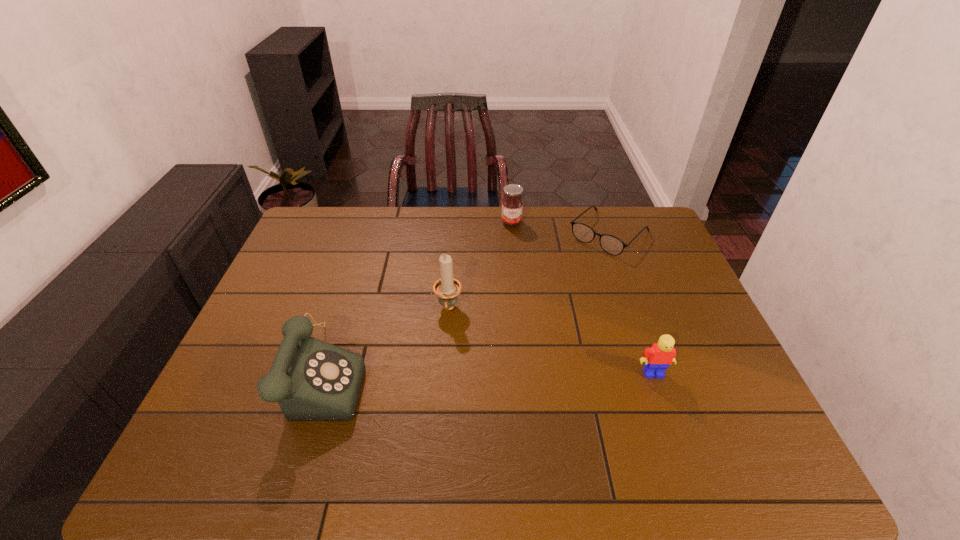
Locate an element on the screen. the leftmost object is located at coordinates (312, 380).

Identify the location of telephone. The width and height of the screenshot is (960, 540). (312, 380).

Find the location of a particular element. Lego is located at coordinates point(657,358).

Where is `the third object from right to left`? Image resolution: width=960 pixels, height=540 pixels. the third object from right to left is located at coordinates (512, 204).

What are the coordinates of `spectacles` in the screenshot? It's located at (612, 245).

Where is `the fourth object from right to left`? the fourth object from right to left is located at coordinates (447, 289).

The width and height of the screenshot is (960, 540). What are the coordinates of `the tallest object` in the screenshot? It's located at (447, 289).

I want to click on free space located on the dial of the leftmost object, so click(438, 373).

The width and height of the screenshot is (960, 540). In order to click on vacant space situated on the front-facing side of the Lego in this screenshot , I will do `click(672, 427)`.

Locate an element on the screen. The width and height of the screenshot is (960, 540). vacant space located on the label side of the jam is located at coordinates (518, 285).